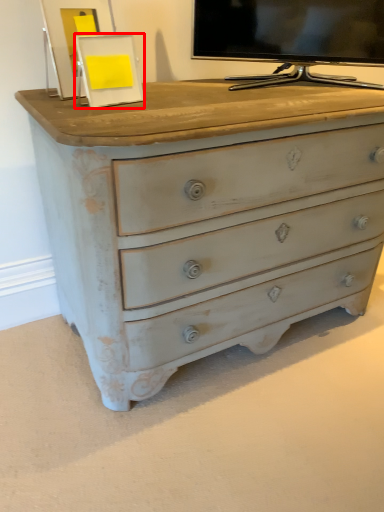
Question: In this image, where is picture frame (annotated by the red box) located relative to television?

Choices:
 (A) left
 (B) right

Answer: (A)